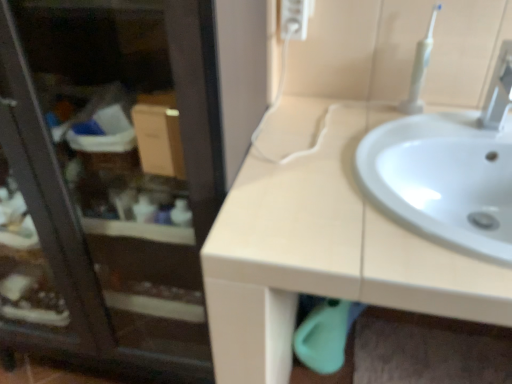
I want to click on unoccupied area in front of white plastic toothbrush at upper right, so click(421, 129).